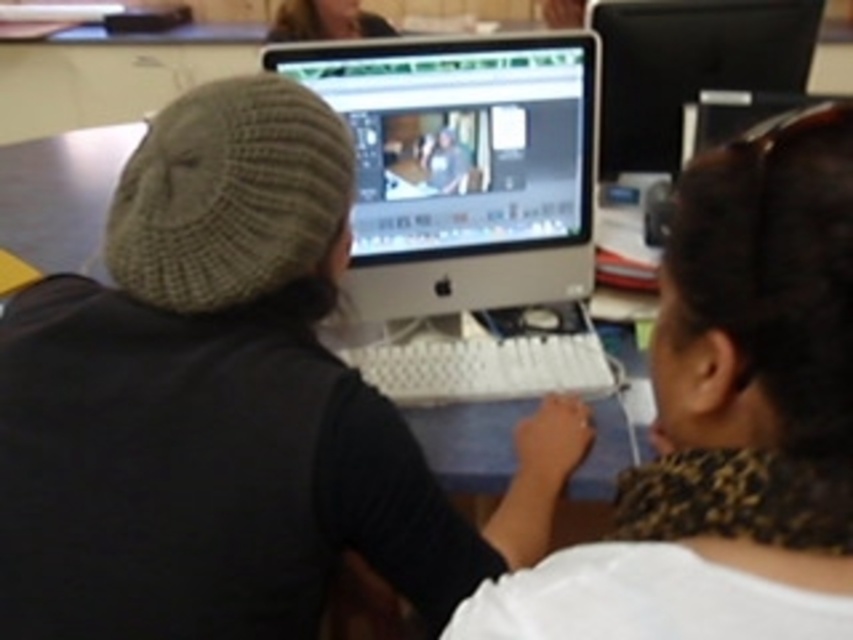
Question: Which of the following is the farthest from the observer?

Choices:
 (A) (9, 204)
 (B) (413, 195)
 (C) (625, 29)

Answer: (A)

Question: Is white textured sweater at center positioned behind smooth skin face at upper center?

Choices:
 (A) yes
 (B) no

Answer: (B)

Question: Which point is farther to the camera?

Choices:
 (A) (708, 528)
 (B) (469, 275)

Answer: (B)

Question: Is white textured sweater at center positioned in front of black glossy monitor at upper right?

Choices:
 (A) yes
 (B) no

Answer: (A)

Question: Estimate the real-world distances between objects in this image. Which object is closer to the smooth skin face at upper center?

Choices:
 (A) black glossy monitor at upper right
 (B) satin white monitor at center

Answer: (A)

Question: Is blue laminate table at center bigger than smooth skin face at upper center?

Choices:
 (A) yes
 (B) no

Answer: (A)